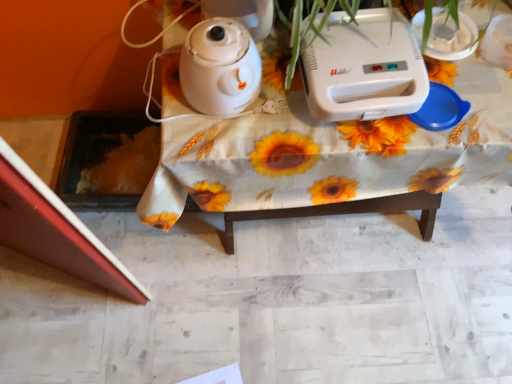
Question: Can you confirm if white plastic toaster at upper center is positioned to the left of white plastic table at center?

Choices:
 (A) no
 (B) yes

Answer: (B)

Question: Does white plastic toaster at upper center have a larger size compared to white plastic table at center?

Choices:
 (A) no
 (B) yes

Answer: (A)

Question: Is the position of white plastic toaster at upper center more distant than that of white plastic table at center?

Choices:
 (A) no
 (B) yes

Answer: (A)

Question: Is white plastic toaster at upper center looking in the opposite direction of white plastic table at center?

Choices:
 (A) no
 (B) yes

Answer: (A)

Question: Is white plastic toaster at upper center at the right side of white plastic table at center?

Choices:
 (A) yes
 (B) no

Answer: (B)

Question: From a real-world perspective, does white plastic toaster at upper center stand above white plastic table at center?

Choices:
 (A) yes
 (B) no

Answer: (A)

Question: Can you confirm if white glossy kettle at upper center is wider than white plastic toaster at upper center?

Choices:
 (A) yes
 (B) no

Answer: (B)

Question: Is white glossy kettle at upper center facing away from white plastic toaster at upper center?

Choices:
 (A) no
 (B) yes

Answer: (A)

Question: Does white glossy kettle at upper center lie behind white plastic toaster at upper center?

Choices:
 (A) yes
 (B) no

Answer: (B)

Question: Can you confirm if white glossy kettle at upper center is positioned to the right of white plastic toaster at upper center?

Choices:
 (A) yes
 (B) no

Answer: (B)

Question: Are white glossy kettle at upper center and white plastic toaster at upper center far apart?

Choices:
 (A) no
 (B) yes

Answer: (A)

Question: Would you say white glossy kettle at upper center is outside white plastic toaster at upper center?

Choices:
 (A) no
 (B) yes

Answer: (B)

Question: Is white plastic table at center not near white glossy kettle at upper center?

Choices:
 (A) no
 (B) yes

Answer: (A)